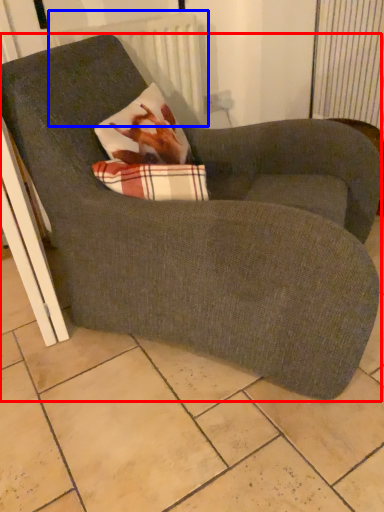
Question: Which of the following is the farthest to the observer, chair (highlighted by a red box) or radiator (highlighted by a blue box)?

Choices:
 (A) chair
 (B) radiator

Answer: (B)